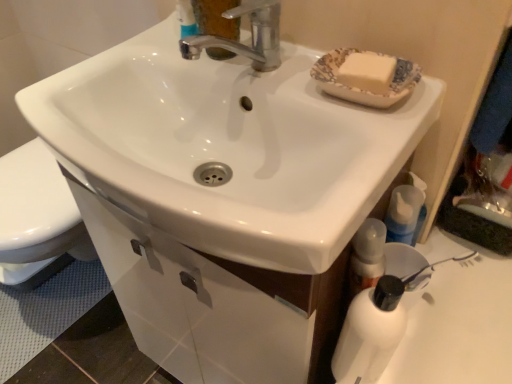
Question: Can you confirm if white glossy drawer at lower center is shorter than white matte bottle at lower right?

Choices:
 (A) yes
 (B) no

Answer: (A)

Question: Is white matte bottle at lower right located within white glossy drawer at lower center?

Choices:
 (A) no
 (B) yes

Answer: (A)

Question: Is white glossy drawer at lower center at the left side of white matte bottle at lower right?

Choices:
 (A) yes
 (B) no

Answer: (A)

Question: Is white glossy drawer at lower center completely or partially outside of white matte bottle at lower right?

Choices:
 (A) no
 (B) yes

Answer: (B)

Question: Can you confirm if white glossy drawer at lower center is bigger than white matte bottle at lower right?

Choices:
 (A) yes
 (B) no

Answer: (A)

Question: Considering the relative positions of white glossy sink at center and white glossy drawer at lower center in the image provided, is white glossy sink at center to the left or to the right of white glossy drawer at lower center?

Choices:
 (A) left
 (B) right

Answer: (B)

Question: From their relative heights in the image, would you say white glossy sink at center is taller or shorter than white glossy drawer at lower center?

Choices:
 (A) short
 (B) tall

Answer: (B)

Question: From the image's perspective, is white glossy sink at center located above or below white glossy drawer at lower center?

Choices:
 (A) below
 (B) above

Answer: (B)

Question: Is white glossy sink at center inside the boundaries of white glossy drawer at lower center, or outside?

Choices:
 (A) inside
 (B) outside

Answer: (B)

Question: Visually, is white glossy sink at center positioned to the left or to the right of white matte bottle at lower right?

Choices:
 (A) right
 (B) left

Answer: (B)

Question: Is white glossy sink at center bigger or smaller than white matte bottle at lower right?

Choices:
 (A) small
 (B) big

Answer: (B)

Question: Is white glossy sink at center inside the boundaries of white matte bottle at lower right, or outside?

Choices:
 (A) outside
 (B) inside

Answer: (A)

Question: From their relative heights in the image, would you say white glossy sink at center is taller or shorter than white matte bottle at lower right?

Choices:
 (A) tall
 (B) short

Answer: (B)

Question: From the image's perspective, relative to white matte bottle at lower right, is blue translucent bottle at lower right above or below?

Choices:
 (A) below
 (B) above

Answer: (B)

Question: Would you say blue translucent bottle at lower right is to the left or to the right of white matte bottle at lower right in the picture?

Choices:
 (A) left
 (B) right

Answer: (B)